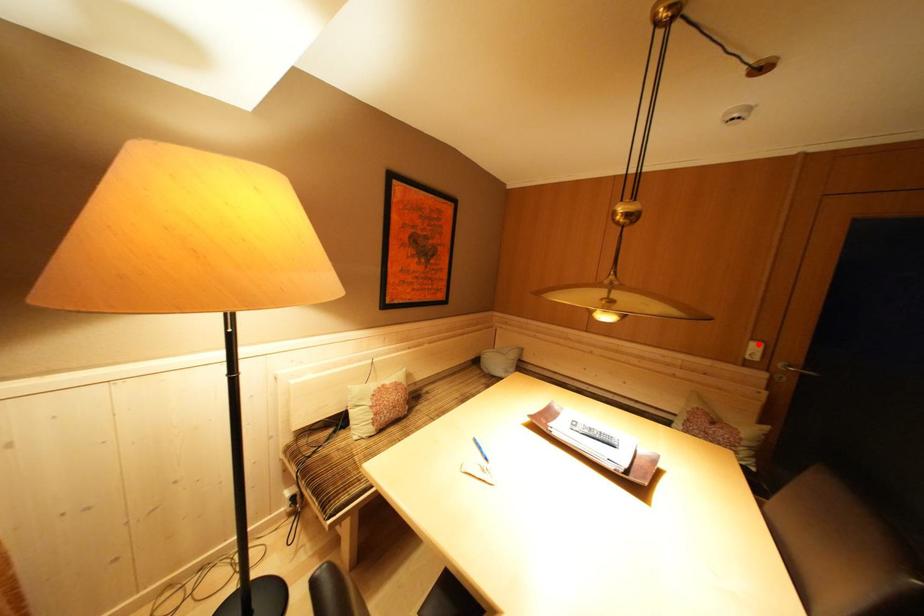
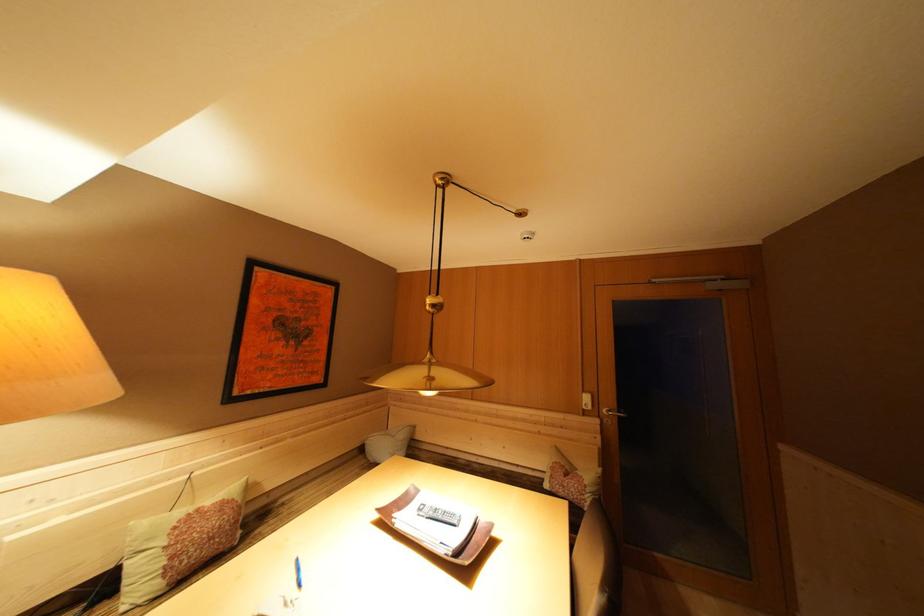
Find the pixel in the second image that matches the highlighted location in the first image.

(590, 397)